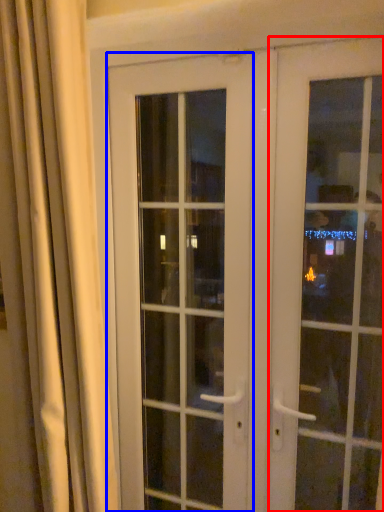
Question: Among these objects, which one is farthest to the camera, door (highlighted by a red box) or door (highlighted by a blue box)?

Choices:
 (A) door
 (B) door

Answer: (B)